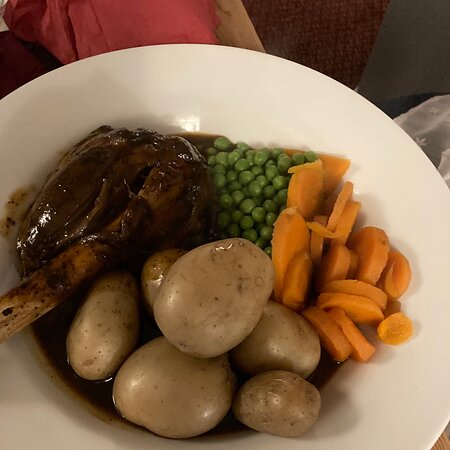
You are a GUI agent. You are given a task and a screenshot of the screen. Output one action in this format:
    pyautogui.click(x=<x>, y=<y>)
    Task: Click on the table
    The image size is (450, 450).
    Given the screenshot: What is the action you would take?
    click(24, 56)